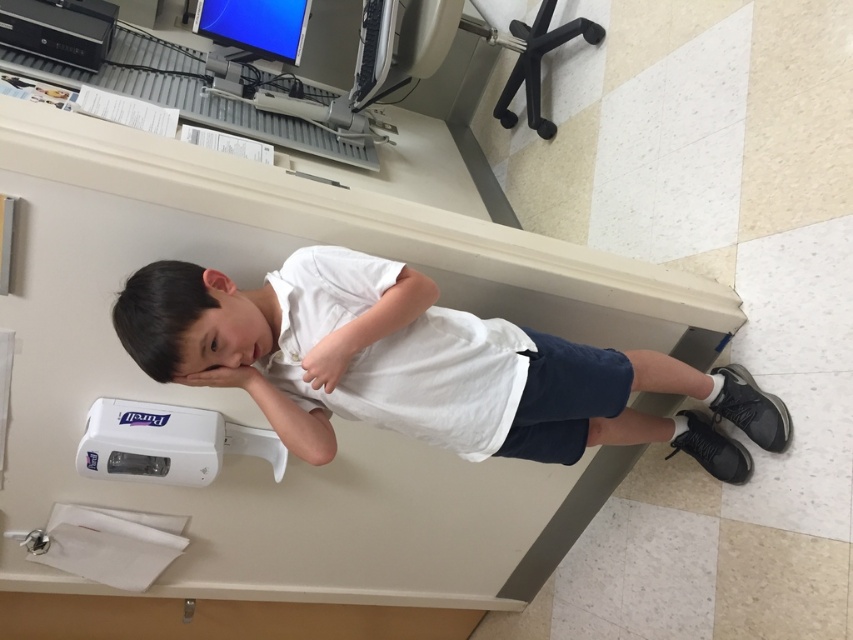
You are a fashion designer observing the boy in the medical office. You need to measure the distance between the white cotton shirt at center and the black matte hair at upper center to design a custom collar for his shirt. Can you determine if the distance between them is sufficient for a standard collar design that requires at least 10 inches of space?

The distance between the white cotton shirt at center and the black matte hair at upper center is 11.45 inches, which is more than the required 10 inches. Therefore, the space is sufficient for a standard collar design.

You are a fashion designer analyzing the image. You need to determine which object occupies more horizontal space in the scene between the white cotton shirt at center and the black matte hair at upper center. Which one is wider?

The white cotton shirt at center might be wider than black matte hair at upper center, so the white cotton shirt at center occupies more horizontal space.

You are a security camera in the room. You need to determine if the white cotton shirt at center is closer to you than the black matte hair at upper center. Based on the scene, what is your conclusion?

The white cotton shirt at center is further to the viewer than the black matte hair at upper center, so the shirt is closer to the camera than the hair.